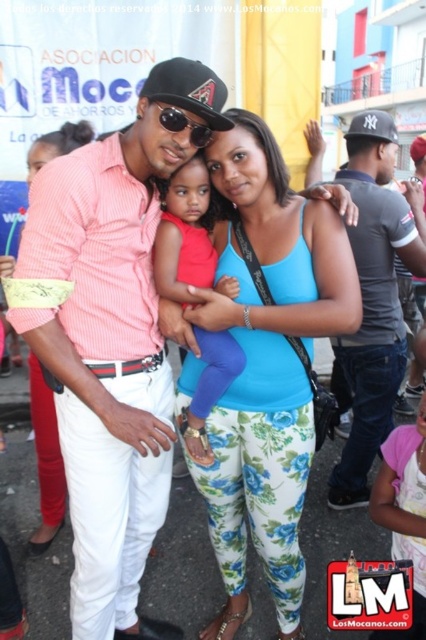
Is blue floral leggings at center further to camera compared to black cotton t-shirt at right?

No, blue floral leggings at center is in front of black cotton t-shirt at right.

Is blue floral leggings at center smaller than black cotton t-shirt at right?

Correct, blue floral leggings at center occupies less space than black cotton t-shirt at right.

Is point (287, 237) positioned in front of point (360, 483)?

Yes, point (287, 237) is closer to viewer.

At what (x,y) coordinates should I click in order to perform the action: click on blue floral leggings at center. Please return your answer as a coordinate pair (x, y). The width and height of the screenshot is (426, 640). Looking at the image, I should click on (267, 365).

From the picture: Who is lower down, matte red dress at center or black matte baseball cap at center?

matte red dress at center is below.

Between point (187, 266) and point (190, 84), which one is positioned in front?

Point (190, 84) is more forward.

You are a GUI agent. You are given a task and a screenshot of the screen. Output one action in this format:
    pyautogui.click(x=<x>, y=<y>)
    Task: Click on the matte red dress at center
    This screenshot has height=640, width=426.
    Given the screenshot: What is the action you would take?
    pyautogui.click(x=184, y=236)

Locate an element on the screen. Image resolution: width=426 pixels, height=640 pixels. matte red dress at center is located at coordinates (184, 236).

Does black cotton t-shirt at right appear on the left side of matte red dress at center?

In fact, black cotton t-shirt at right is to the right of matte red dress at center.

Who is lower down, black cotton t-shirt at right or matte red dress at center?

Positioned lower is matte red dress at center.

I want to click on black cotton t-shirt at right, so click(374, 296).

The image size is (426, 640). Identify the location of black cotton t-shirt at right. (374, 296).